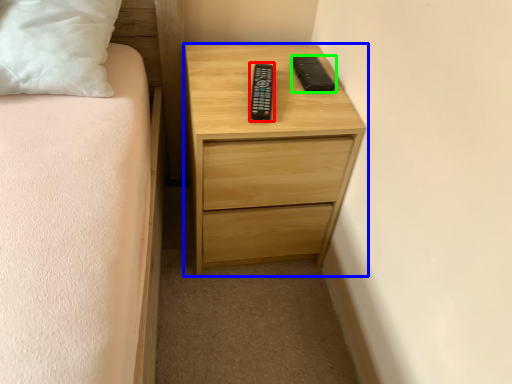
Question: Which object is the farthest from control (highlighted by a red box)? Choose among these: chest of drawers (highlighted by a blue box) or gadget (highlighted by a green box).

Choices:
 (A) chest of drawers
 (B) gadget

Answer: (A)